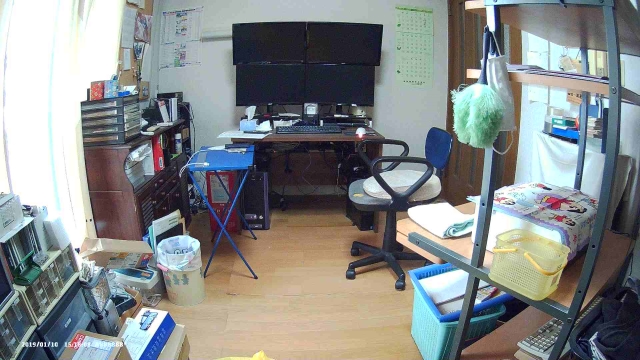
At what (x,y) coordinates should I click in order to perform the action: click on wall. Please return your answer as a coordinate pair (x, y). This screenshot has height=360, width=640. Looking at the image, I should click on (409, 114), (211, 72).